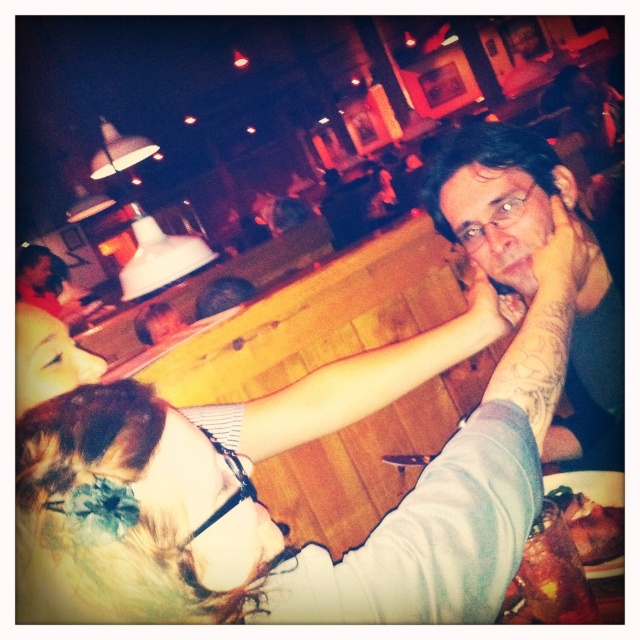
Does point (616, 609) come in front of point (496, 285)?

That is True.

Between point (573, 532) and point (508, 298), which one is positioned behind?

Positioned behind is point (508, 298).

Between point (518, 586) and point (497, 296), which one is positioned in front?

Positioned in front is point (518, 586).

Identify the location of wooden table at lower right. (595, 531).

Does multicolored fabric at center have a smaller size compared to matte black glasses at upper right?

Indeed, multicolored fabric at center has a smaller size compared to matte black glasses at upper right.

What do you see at coordinates (268, 513) in the screenshot? The width and height of the screenshot is (640, 640). I see `multicolored fabric at center` at bounding box center [268, 513].

Find the location of a particular element. The image size is (640, 640). multicolored fabric at center is located at coordinates (268, 513).

Does matte black glasses at upper right have a lesser height compared to brown crispy chicken at lower right?

In fact, matte black glasses at upper right may be taller than brown crispy chicken at lower right.

Does matte black glasses at upper right have a greater width compared to brown crispy chicken at lower right?

Yes.

This screenshot has width=640, height=640. What do you see at coordinates (499, 198) in the screenshot? I see `matte black glasses at upper right` at bounding box center [499, 198].

Find the location of a particular element. This screenshot has width=640, height=640. matte black glasses at upper right is located at coordinates (499, 198).